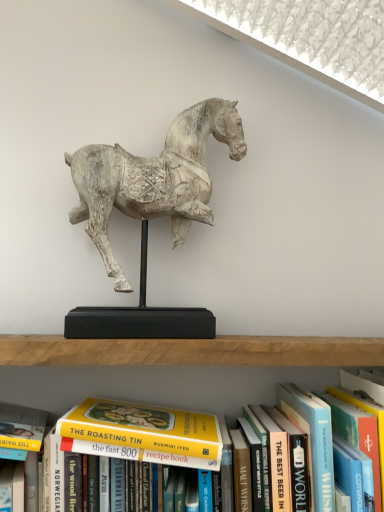
Question: Which direction should I rotate to look at hardcover book at center, the 1th paperback book viewed from the right, — up or down?

Choices:
 (A) up
 (B) down

Answer: (B)

Question: Should I look upward or downward to see white wood horse at center?

Choices:
 (A) down
 (B) up

Answer: (B)

Question: Is white wood horse at center closer to the viewer compared to hardcover book at center, acting as the 2th paperback book starting from the right?

Choices:
 (A) no
 (B) yes

Answer: (A)

Question: Does white wood horse at center have a smaller size compared to hardcover book at center, acting as the 2th paperback book starting from the right?

Choices:
 (A) yes
 (B) no

Answer: (B)

Question: From the image's perspective, does white wood horse at center appear lower than hardcover book at center, acting as the 2th paperback book starting from the right?

Choices:
 (A) no
 (B) yes

Answer: (A)

Question: Is white wood horse at center shorter than hardcover book at center, acting as the 2th paperback book starting from the right?

Choices:
 (A) yes
 (B) no

Answer: (B)

Question: Does white wood horse at center have a lesser width compared to hardcover book at center, acting as the 2th paperback book starting from the right?

Choices:
 (A) yes
 (B) no

Answer: (A)

Question: Can you confirm if white wood horse at center is positioned to the right of hardcover book at center, acting as the 2th paperback book starting from the right?

Choices:
 (A) yes
 (B) no

Answer: (B)

Question: Is yellow paperback book at center oriented away from white wood horse at center?

Choices:
 (A) no
 (B) yes

Answer: (A)

Question: Is yellow paperback book at center at the right side of white wood horse at center?

Choices:
 (A) yes
 (B) no

Answer: (B)

Question: Is the position of yellow paperback book at center more distant than that of white wood horse at center?

Choices:
 (A) no
 (B) yes

Answer: (A)

Question: Is yellow paperback book at center aimed at white wood horse at center?

Choices:
 (A) no
 (B) yes

Answer: (A)

Question: Is yellow paperback book at center positioned far away from white wood horse at center?

Choices:
 (A) yes
 (B) no

Answer: (B)

Question: Is yellow paperback book at center wider than white wood horse at center?

Choices:
 (A) no
 (B) yes

Answer: (B)

Question: Can we say hardcover book at center, the 1th paperback book viewed from the right, lies outside white wood horse at center?

Choices:
 (A) yes
 (B) no

Answer: (A)